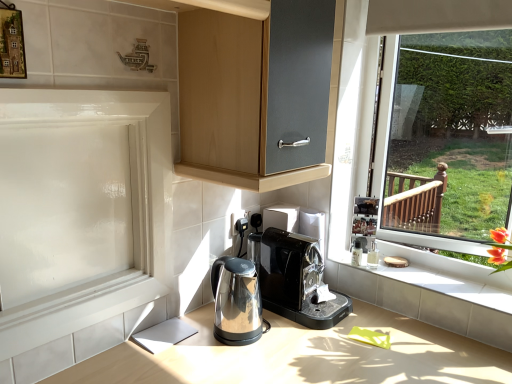
Locate an element on the screen. The image size is (512, 384). vacant space to the right of stainless steel kettle at lower center, the second home appliance from the right is located at coordinates (297, 345).